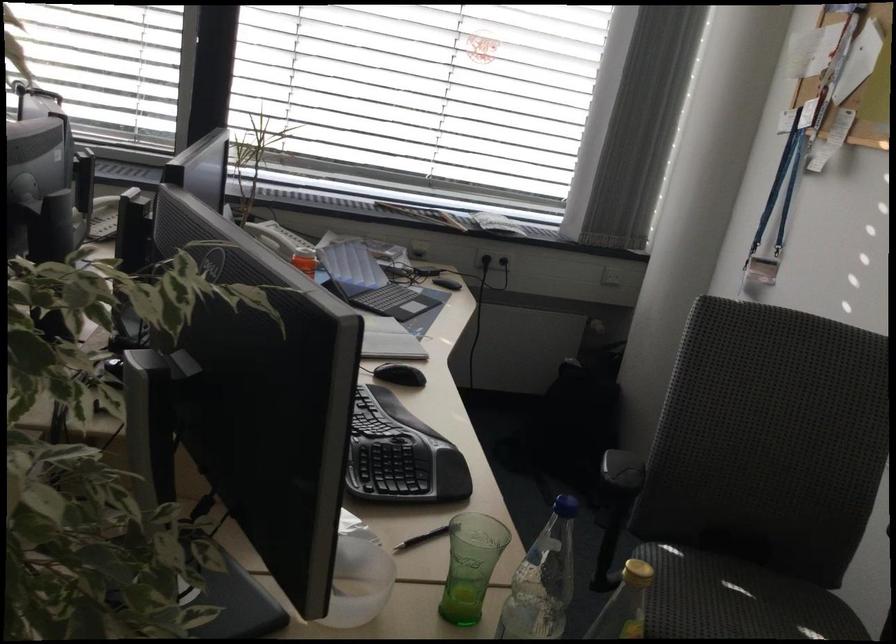
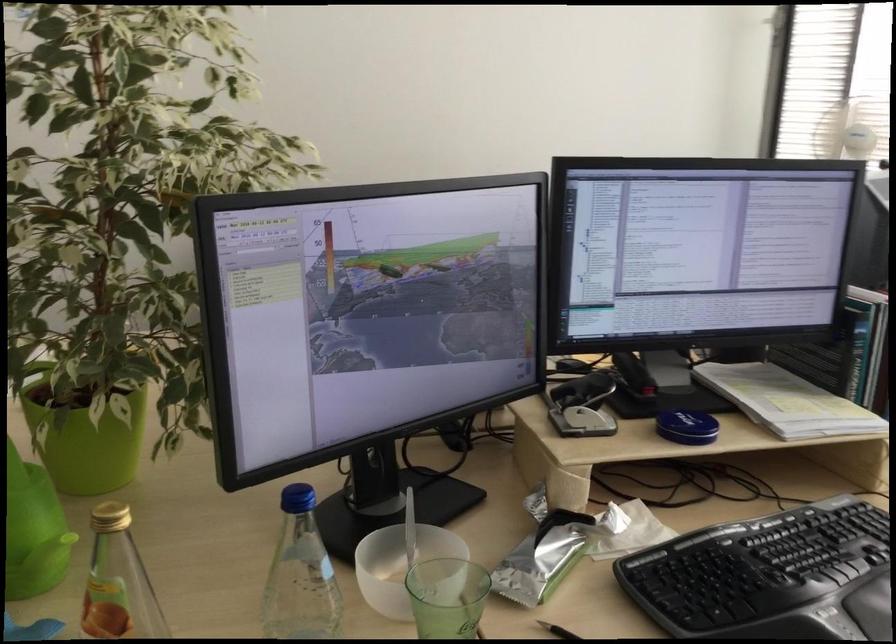
Find the pixel in the second image that matches (x=388, y=544) in the first image.

(557, 630)